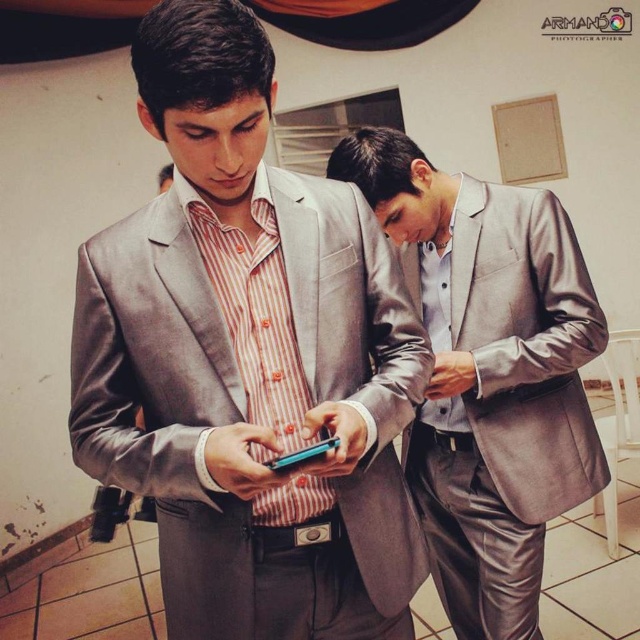
You are standing in a room and see a point marked at coordinates [257,173]. If you want to place a small teal device exactly where that point is, will you be able to reach it without moving closer?

The point at coordinates [257,173] is 3.62 feet away from you, so you can reach it without moving closer if your arm length is sufficient to cover that distance.

You are a photographer standing at the entrance of the room. You need to take a group photo of the two people in the satin gray suit at center. Can you fit both of them in your camera frame if your camera has a maximum width of 4 feet?

The two individuals in the satin gray suit at center are 4.50 feet apart. Since the camera frame can only accommodate up to 4 feet, they are slightly too far apart to fit within the frame.